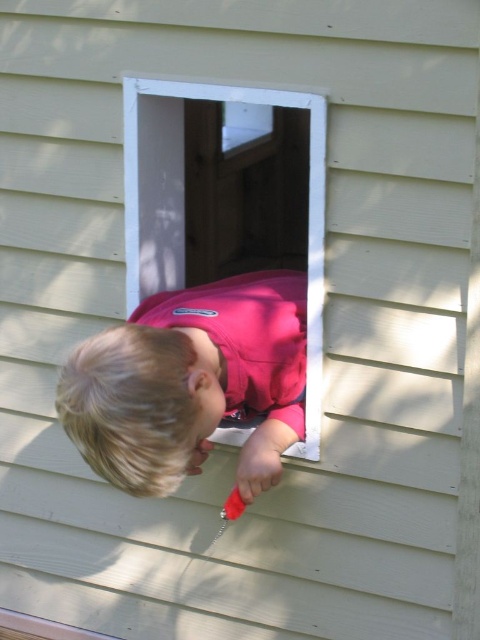
Question: Which of the following is the closest to the observer?

Choices:
 (A) (166, 428)
 (B) (317, 172)

Answer: (A)

Question: Is pink matte shirt at center further to camera compared to white plastic window at center?

Choices:
 (A) no
 (B) yes

Answer: (A)

Question: Does pink matte shirt at center have a larger size compared to white plastic window at center?

Choices:
 (A) no
 (B) yes

Answer: (A)

Question: Does pink matte shirt at center have a larger size compared to white plastic window at center?

Choices:
 (A) yes
 (B) no

Answer: (B)